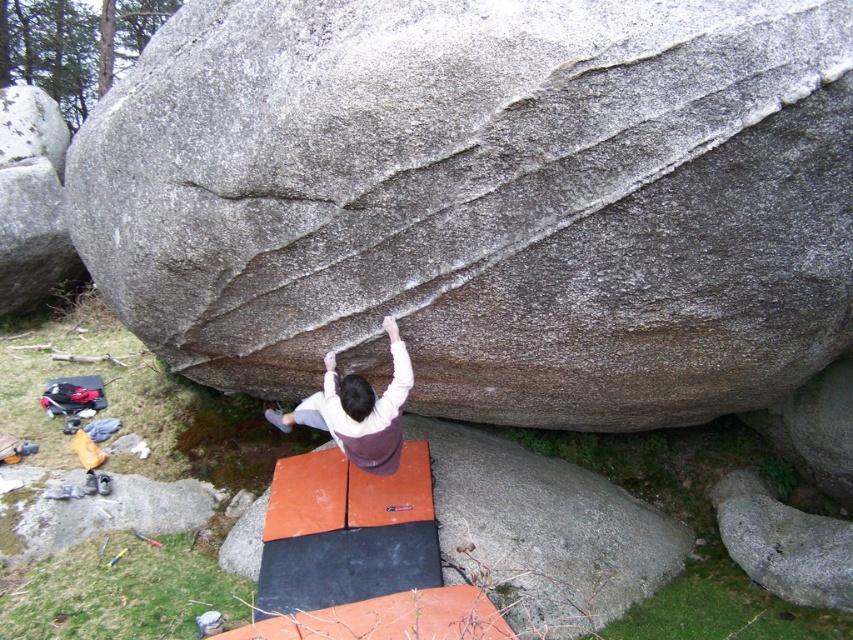
Question: Which is farther from the white matte shirt at center?

Choices:
 (A) gray textured rock at center
 (B) orange rubber mat at center

Answer: (A)

Question: Is gray textured rock at center behind white matte shirt at center?

Choices:
 (A) yes
 (B) no

Answer: (B)

Question: Can you confirm if gray textured rock at center is wider than orange rubber mat at center?

Choices:
 (A) yes
 (B) no

Answer: (A)

Question: Among these objects, which one is farthest from the camera?

Choices:
 (A) gray textured rock at center
 (B) orange rubber mat at center

Answer: (B)

Question: Is gray textured rock at center thinner than orange rubber mat at center?

Choices:
 (A) no
 (B) yes

Answer: (A)

Question: Which object is the closest to the white matte shirt at center?

Choices:
 (A) orange rubber mat at center
 (B) gray textured rock at center

Answer: (A)